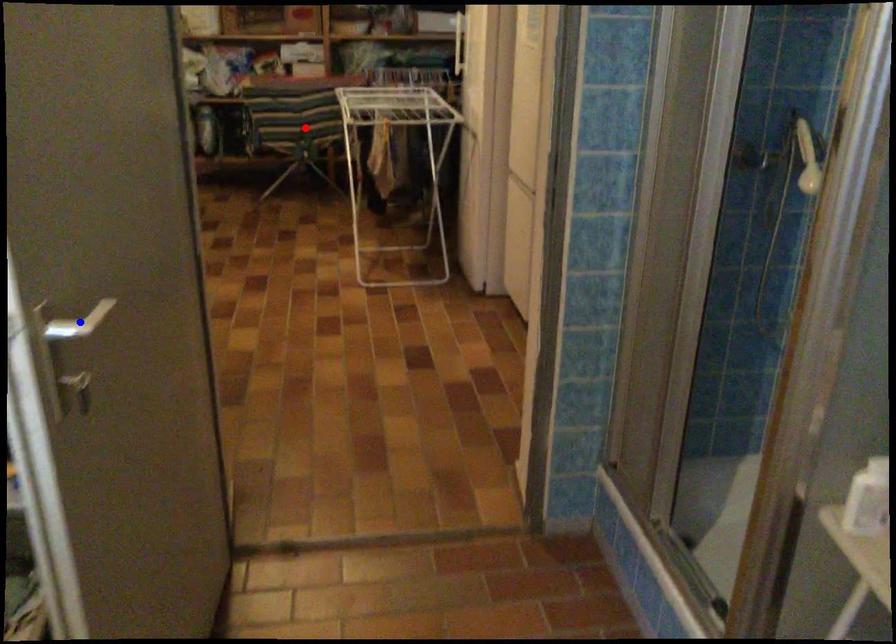
Question: Which of the two points in the image is closer to the camera?

Choices:
 (A) Blue point is closer.
 (B) Red point is closer.

Answer: (A)